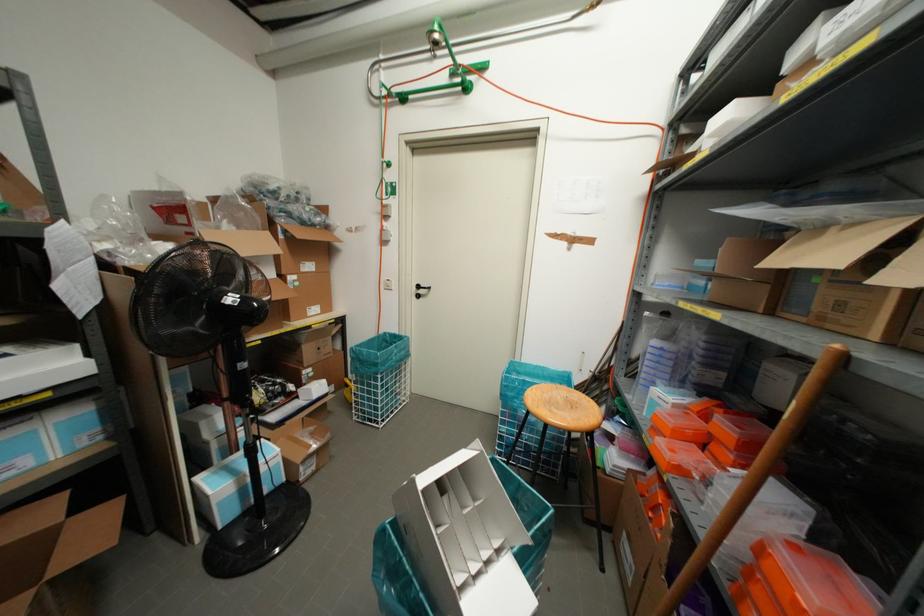
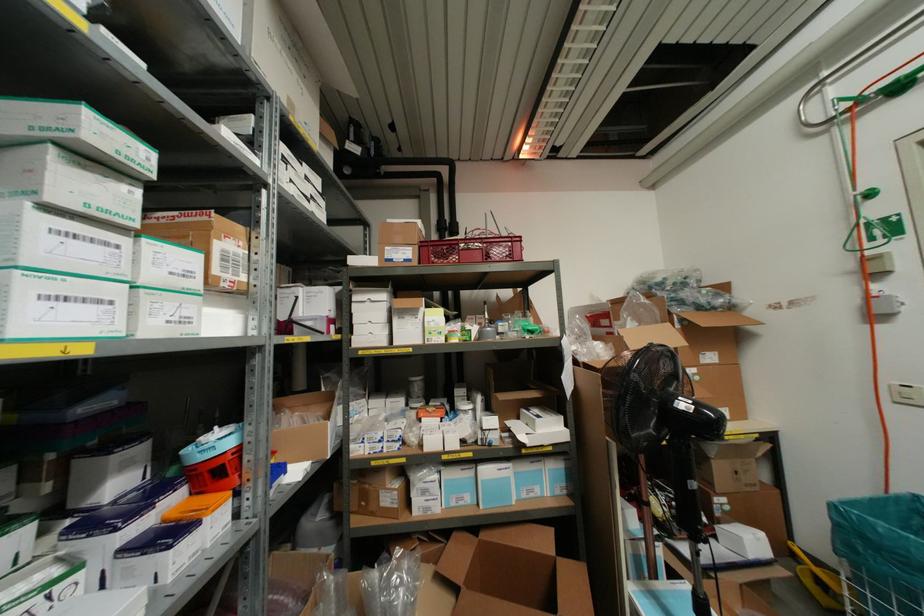
In the second image, find the point that corresponds to point (234, 464) in the first image.

(663, 601)